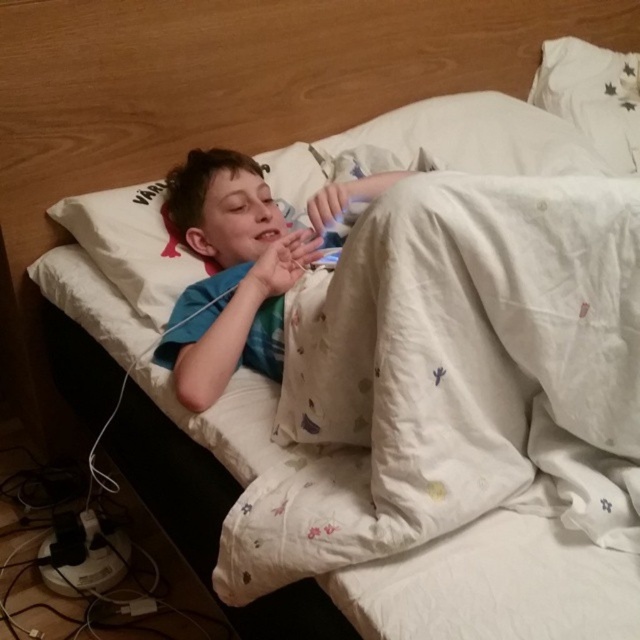
You are a parent checking on your child. You see the white cotton pillow at upper left and the blue cotton shirt at center. Which item is bigger in size?

The white cotton pillow at upper left is larger in size than the blue cotton shirt at center.

You are standing in the room and want to reach the blue cotton shirt at center. The nightstand is between you and the shirt. Is the nightstand closer to you or to the shirt?

The nightstand is closer to the blue cotton shirt at center. Since the distance between the blue cotton shirt at center and the viewer is 39.25 inches, and the nightstand is between them, the nightstand must be closer to the shirt than to you.

You are a sleep consultant visiting a client. You need to adjust the blue cotton shirt at center so that it is positioned to the left of the white cotton pillow at upper left. Is the current arrangement already meeting this requirement?

The white cotton pillow at upper left is to the right of blue cotton shirt at center, so the blue cotton shirt at center is already positioned to the left of the white cotton pillow at upper left. Therefore, the current arrangement meets the requirement.